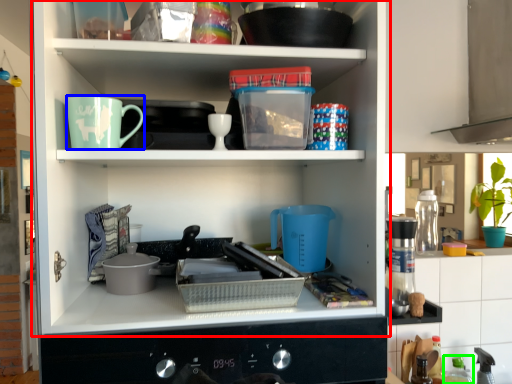
Question: Estimate the real-world distances between objects in this image. Which object is farther from shelf (highlighted by a red box), coffee cup (highlighted by a blue box) or bottle (highlighted by a green box)?

Choices:
 (A) coffee cup
 (B) bottle

Answer: (B)